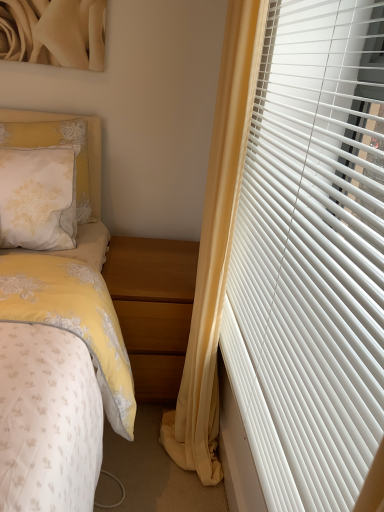
Question: Would you say light brown wood at lower center is a long distance from white lace pillow at upper left?

Choices:
 (A) yes
 (B) no

Answer: (B)

Question: From a real-world perspective, is light brown wood at lower center physically above white lace pillow at upper left?

Choices:
 (A) no
 (B) yes

Answer: (A)

Question: Is the depth of light brown wood at lower center less than that of white lace pillow at upper left?

Choices:
 (A) yes
 (B) no

Answer: (A)

Question: Does light brown wood at lower center appear on the right side of white lace pillow at upper left?

Choices:
 (A) yes
 (B) no

Answer: (A)

Question: Can you confirm if light brown wood at lower center is positioned to the left of white lace pillow at upper left?

Choices:
 (A) no
 (B) yes

Answer: (A)

Question: From a real-world perspective, relative to yellow fabric curtain at right, is white plastic blinds at right vertically above or below?

Choices:
 (A) below
 (B) above

Answer: (B)

Question: Does point tap(264, 216) appear closer or farther from the camera than point tap(201, 251)?

Choices:
 (A) closer
 (B) farther

Answer: (A)

Question: In terms of height, does white plastic blinds at right look taller or shorter compared to yellow fabric curtain at right?

Choices:
 (A) short
 (B) tall

Answer: (A)

Question: Considering their positions, is white plastic blinds at right located in front of or behind yellow fabric curtain at right?

Choices:
 (A) front
 (B) behind

Answer: (A)

Question: Is white lace pillow at upper left spatially inside white plastic blinds at right, or outside of it?

Choices:
 (A) outside
 (B) inside

Answer: (A)

Question: Considering the positions of white lace pillow at upper left and white plastic blinds at right in the image, is white lace pillow at upper left wider or thinner than white plastic blinds at right?

Choices:
 (A) wide
 (B) thin

Answer: (A)

Question: Based on their sizes in the image, would you say white lace pillow at upper left is bigger or smaller than white plastic blinds at right?

Choices:
 (A) small
 (B) big

Answer: (A)

Question: From the image's perspective, is white lace pillow at upper left above or below white plastic blinds at right?

Choices:
 (A) above
 (B) below

Answer: (A)

Question: Do you think light brown wood at lower center is within yellow fabric curtain at right, or outside of it?

Choices:
 (A) outside
 (B) inside

Answer: (A)

Question: In terms of size, does light brown wood at lower center appear bigger or smaller than yellow fabric curtain at right?

Choices:
 (A) big
 (B) small

Answer: (B)